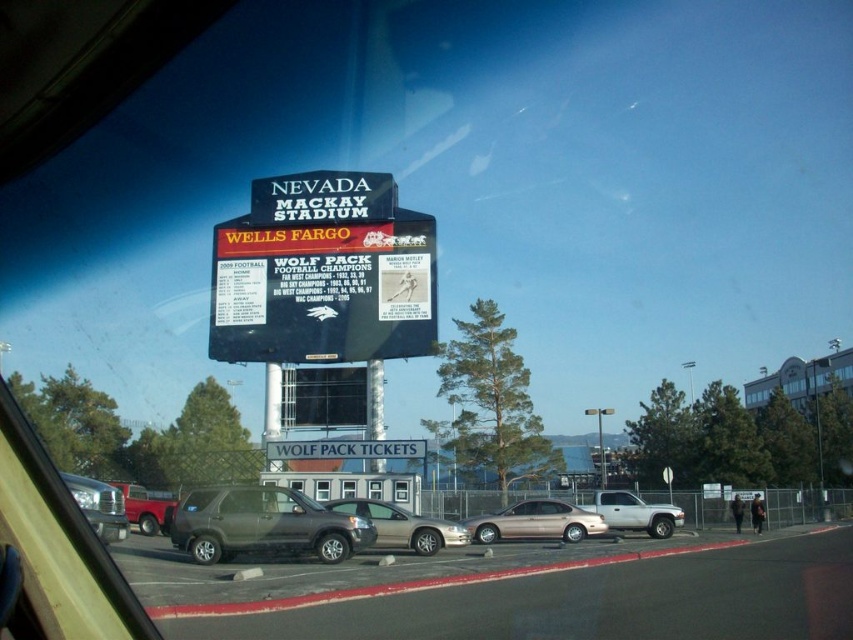
Question: Among these objects, which one is farthest from the camera?

Choices:
 (A) metallic pole at center
 (B) matte red truck at left
 (C) gold metallic sedan at center
 (D) metallic silver truck at lower left

Answer: (A)

Question: Which object appears farthest from the camera in this image?

Choices:
 (A) metallic pole at center
 (B) matte gray suv at center
 (C) gold metallic sedan at center

Answer: (A)

Question: Can you confirm if gold metallic sedan at center is positioned above metallic silver truck at lower left?

Choices:
 (A) yes
 (B) no

Answer: (B)

Question: Which object is closer to the camera taking this photo?

Choices:
 (A) metallic pole at center
 (B) metallic silver sedan at center
 (C) black plastic billboard at center

Answer: (B)

Question: Can you confirm if black plastic billboard at center is smaller than matte gray suv at center?

Choices:
 (A) yes
 (B) no

Answer: (B)

Question: Does matte gray suv at center have a lesser width compared to metallic pole at center?

Choices:
 (A) no
 (B) yes

Answer: (A)